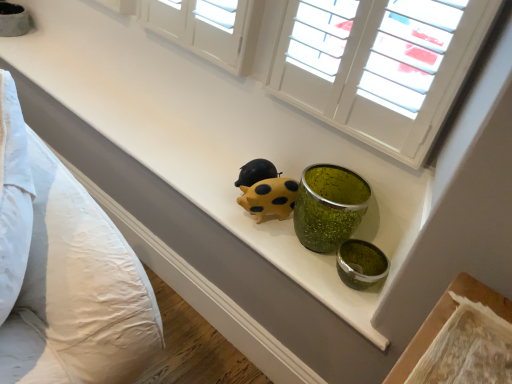
Question: Would you say yellow matte rubber ladybug at center contains white textured shutters at upper center?

Choices:
 (A) no
 (B) yes

Answer: (A)

Question: Considering the relative sizes of yellow matte rubber ladybug at center and white textured shutters at upper center in the image provided, is yellow matte rubber ladybug at center thinner than white textured shutters at upper center?

Choices:
 (A) yes
 (B) no

Answer: (B)

Question: Is yellow matte rubber ladybug at center bigger than white textured shutters at upper center?

Choices:
 (A) no
 (B) yes

Answer: (A)

Question: Could you tell me if yellow matte rubber ladybug at center is facing white textured shutters at upper center?

Choices:
 (A) yes
 (B) no

Answer: (B)

Question: Is yellow matte rubber ladybug at center outside white textured shutters at upper center?

Choices:
 (A) no
 (B) yes

Answer: (B)

Question: Considering the positions of point (271, 185) and point (38, 148), is point (271, 185) closer or farther from the camera than point (38, 148)?

Choices:
 (A) closer
 (B) farther

Answer: (B)

Question: From the image's perspective, is yellow matte rubber ladybug at center positioned above or below white cotton pillows at left?

Choices:
 (A) above
 (B) below

Answer: (A)

Question: Which is correct: yellow matte rubber ladybug at center is inside white cotton pillows at left, or outside of it?

Choices:
 (A) outside
 (B) inside

Answer: (A)

Question: Considering the positions of yellow matte rubber ladybug at center and white cotton pillows at left in the image, is yellow matte rubber ladybug at center bigger or smaller than white cotton pillows at left?

Choices:
 (A) big
 (B) small

Answer: (B)

Question: Considering the positions of white cotton pillows at left and yellow matte rubber ladybug at center in the image, is white cotton pillows at left wider or thinner than yellow matte rubber ladybug at center?

Choices:
 (A) wide
 (B) thin

Answer: (A)

Question: Is point (51, 279) positioned closer to the camera than point (267, 206)?

Choices:
 (A) farther
 (B) closer

Answer: (B)

Question: From the image's perspective, is white cotton pillows at left located above or below yellow matte rubber ladybug at center?

Choices:
 (A) below
 (B) above

Answer: (A)

Question: Relative to yellow matte rubber ladybug at center, is white cotton pillows at left in front or behind?

Choices:
 (A) behind
 (B) front

Answer: (B)

Question: From their relative heights in the image, would you say white textured shutters at upper center is taller or shorter than white cotton pillows at left?

Choices:
 (A) short
 (B) tall

Answer: (A)

Question: Is point (429, 56) closer or farther from the camera than point (83, 253)?

Choices:
 (A) closer
 (B) farther

Answer: (B)